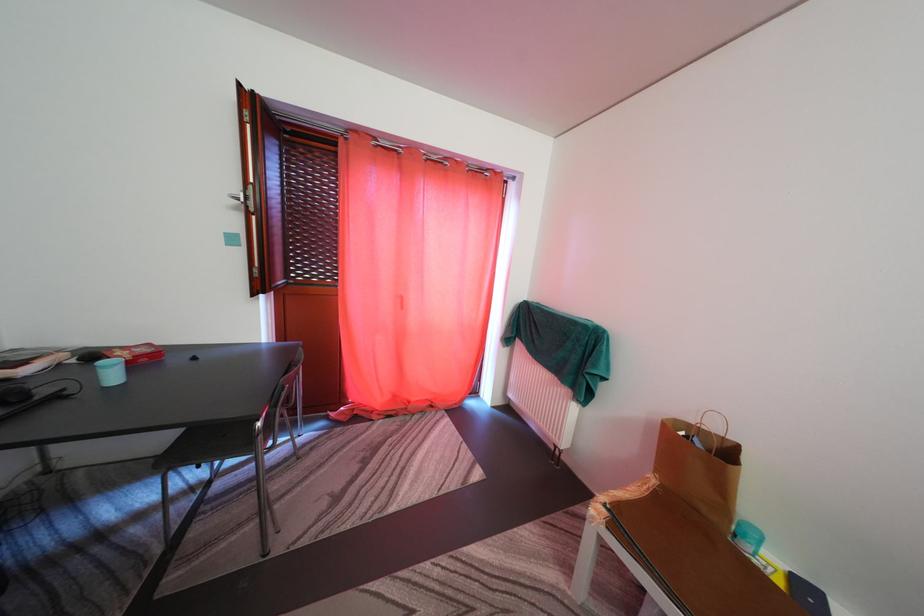
This screenshot has height=616, width=924. In order to click on paper bag handle in this screenshot , I will do `click(707, 432)`.